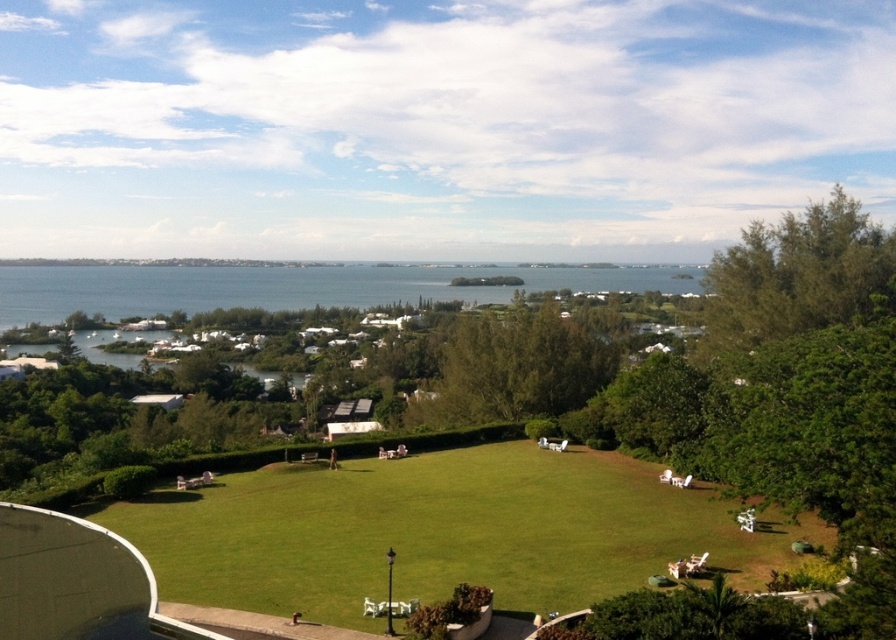
Question: Does blue water at center come behind green leafy tree at upper right?

Choices:
 (A) yes
 (B) no

Answer: (A)

Question: Does blue water at center appear over green leafy tree at center?

Choices:
 (A) no
 (B) yes

Answer: (B)

Question: Considering the real-world distances, which object is farthest from the green leafy tree at center?

Choices:
 (A) green grass lawn at center
 (B) blue water at center

Answer: (B)

Question: Which point is closer to the camera taking this photo?

Choices:
 (A) (441, 388)
 (B) (704, 518)
 (C) (705, 324)
 (D) (135, 278)

Answer: (B)

Question: Which object is closer to the camera taking this photo?

Choices:
 (A) green leafy tree at upper right
 (B) green leafy tree at center
 (C) blue water at center
 (D) green grass lawn at center

Answer: (D)

Question: Does green grass lawn at center lie in front of blue water at center?

Choices:
 (A) no
 (B) yes

Answer: (B)